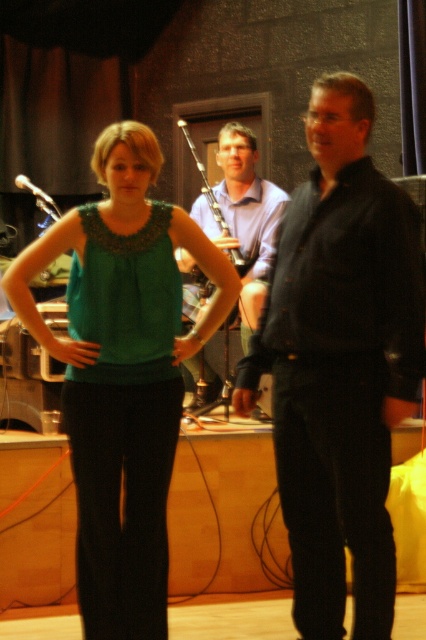
Which of these two, green fabric dress at center or wooden bagpipe at center, stands shorter?

Standing shorter between the two is wooden bagpipe at center.

Is green fabric dress at center further to camera compared to wooden bagpipe at center?

Answer: No, it is not.

Describe the element at coordinates (123, 420) in the screenshot. I see `green fabric dress at center` at that location.

The height and width of the screenshot is (640, 426). In order to click on green fabric dress at center in this screenshot , I will do `click(123, 420)`.

Does point (137, 320) come closer to viewer compared to point (34, 189)?

That is True.

Who is positioned more to the right, green fabric dress at center or metallic silver microphone at upper left?

Positioned to the right is green fabric dress at center.

You are a GUI agent. You are given a task and a screenshot of the screen. Output one action in this format:
    pyautogui.click(x=<x>, y=<y>)
    Task: Click on the green fabric dress at center
    
    Given the screenshot: What is the action you would take?
    pyautogui.click(x=123, y=420)

Where is `green fabric dress at center`? green fabric dress at center is located at coordinates (123, 420).

Does black textured suit at center have a greater height compared to green fabric dress at center?

Correct, black textured suit at center is much taller as green fabric dress at center.

Is point (377, 436) behind point (126, 417)?

No, (377, 436) is closer to viewer.

I want to click on black textured suit at center, so click(x=339, y=364).